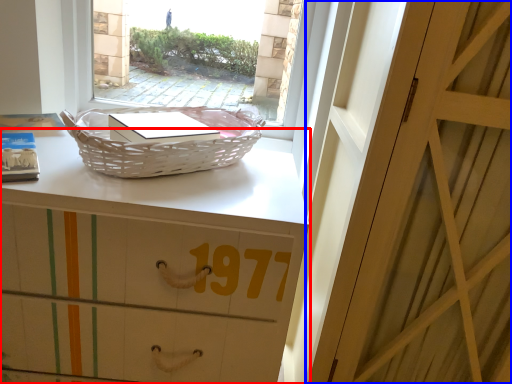
Question: Which object appears farthest to the camera in this image, desk (highlighted by a red box) or door (highlighted by a blue box)?

Choices:
 (A) desk
 (B) door

Answer: (A)